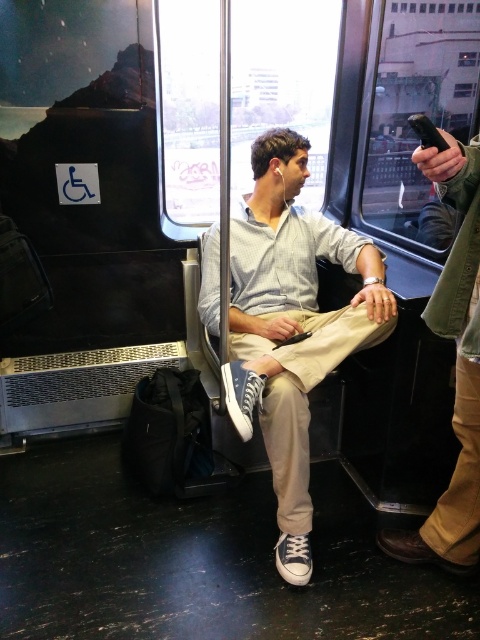
What do you see at coordinates (291, 324) in the screenshot?
I see `light gray cotton shirt at center` at bounding box center [291, 324].

Who is positioned more to the right, light gray cotton shirt at center or brown leather phone at right?

From the viewer's perspective, brown leather phone at right appears more on the right side.

Who is more forward, [352,317] or [470,483]?

Positioned in front is point [470,483].

Find the location of a particular element. light gray cotton shirt at center is located at coordinates (291, 324).